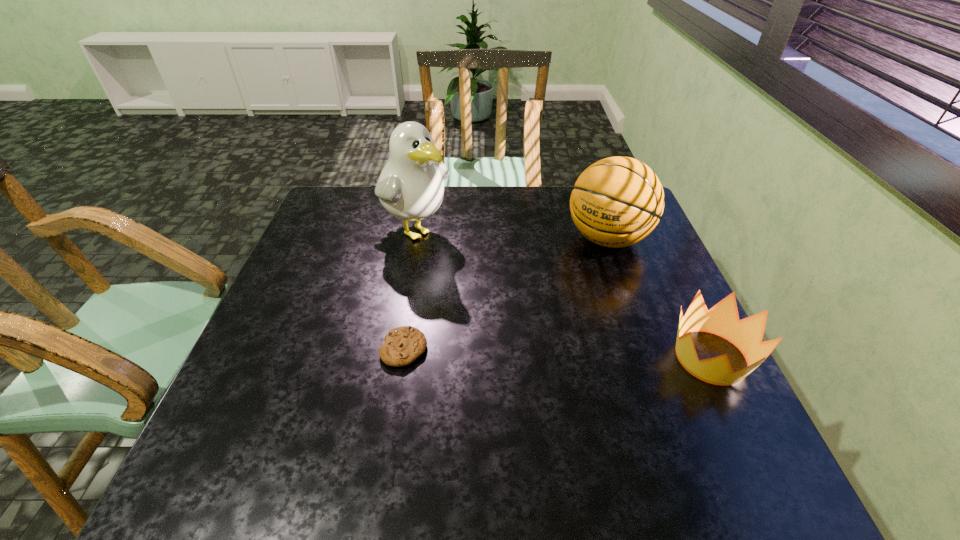
At what (x,y) coordinates should I click in order to perform the action: click on free spot on the desktop that is between the cookie and the third tallest object and is positioned on the surface of the second tallest object near the brand logo. Please return your answer as a coordinate pair (x, y). Looking at the image, I should click on (514, 352).

The image size is (960, 540). I want to click on vacant space on the desktop that is between the cookie and the crown and is positioned on the beak of the gull, so click(x=588, y=354).